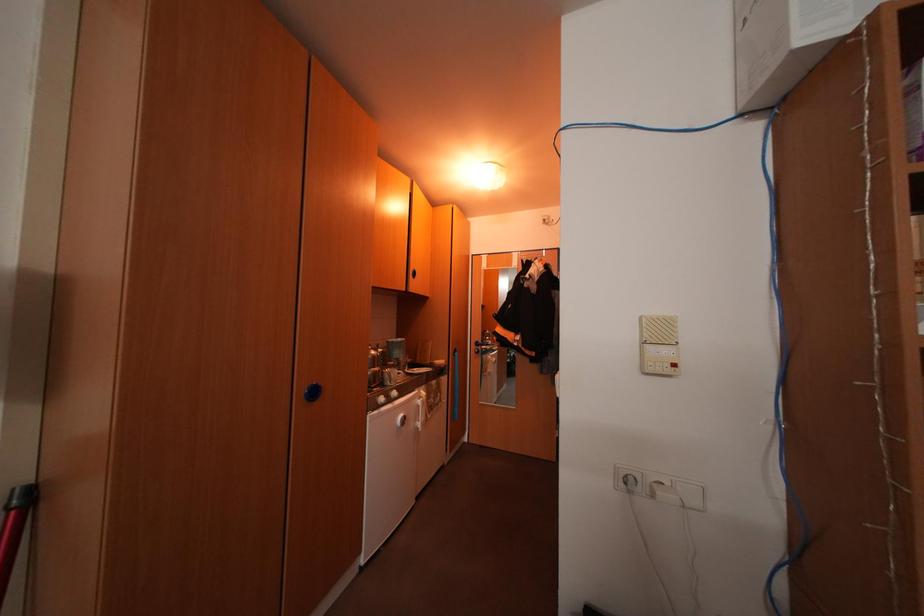
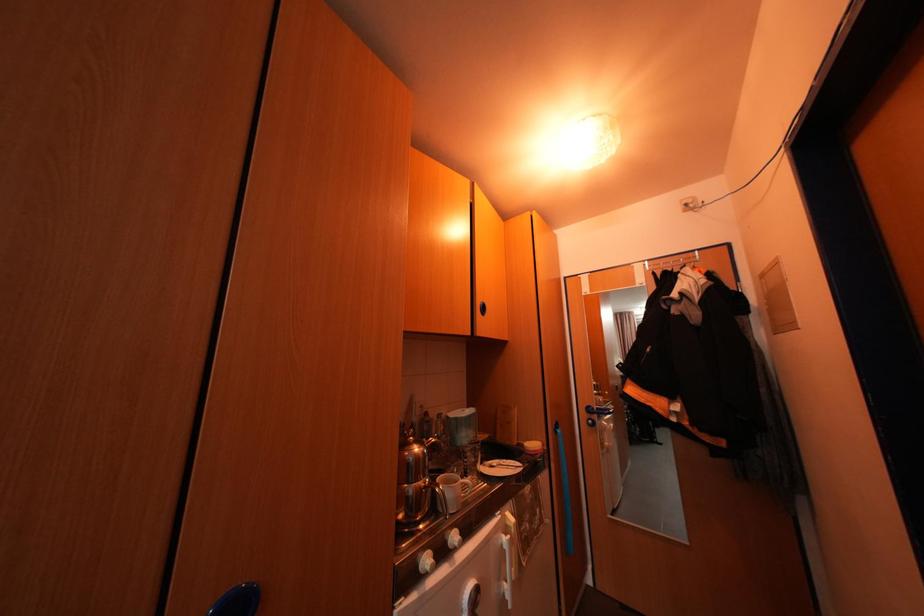
Question: What movement of the cameraman would produce the second image?

Choices:
 (A) Left
 (B) Right
 (C) Forward
 (D) Backward

Answer: (C)